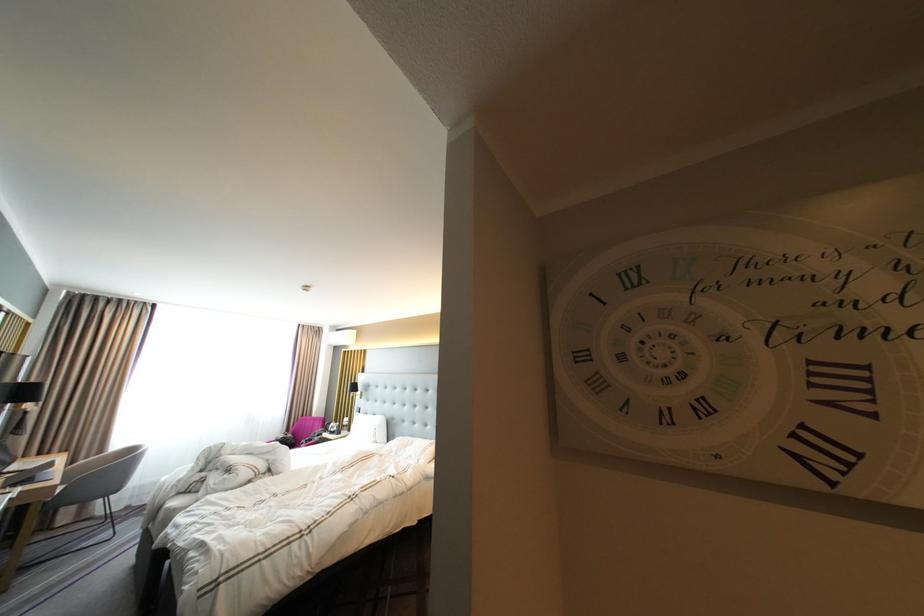
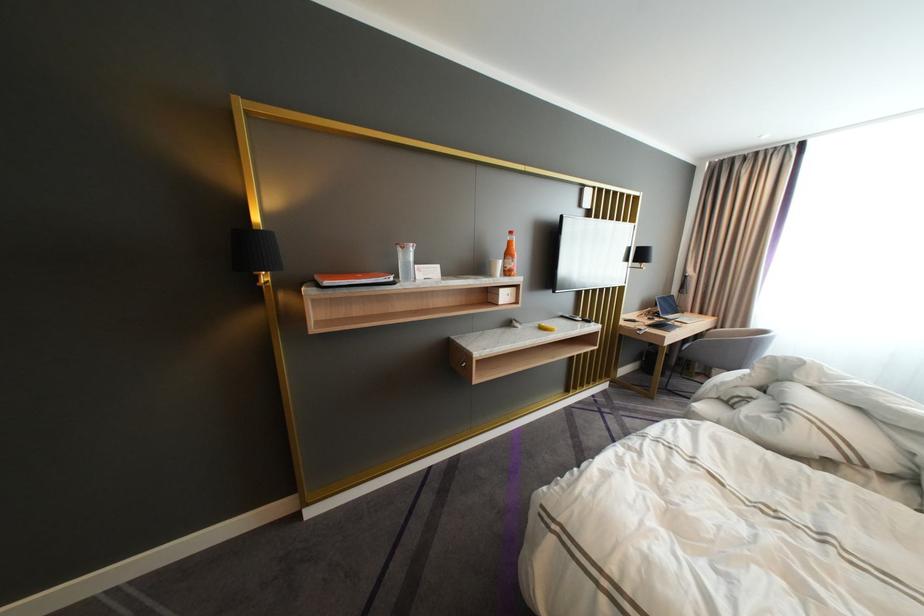
Where in the second image is the point corresponding to [27,468] from the first image?

(683, 317)